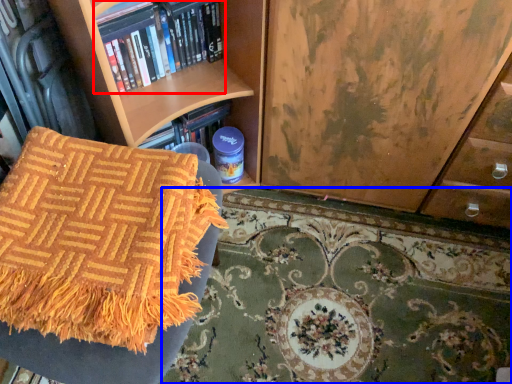
Question: Among these objects, which one is farthest to the camera, book (highlighted by a red box) or mat (highlighted by a blue box)?

Choices:
 (A) book
 (B) mat

Answer: (B)